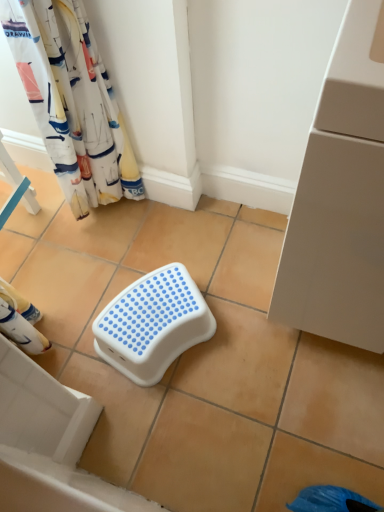
Where is `vacant area that is situated to the right of white fabric curtain at upper left`? This screenshot has height=512, width=384. vacant area that is situated to the right of white fabric curtain at upper left is located at coordinates (162, 215).